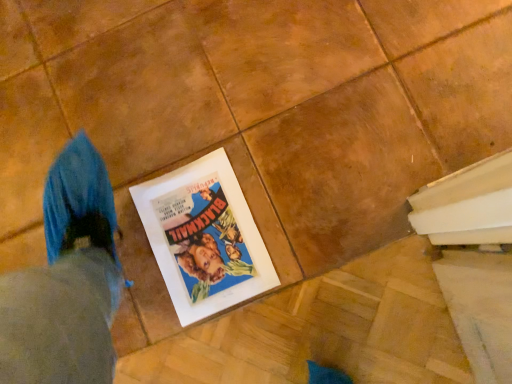
This screenshot has height=384, width=512. Find the location of `vacant area on top of matte paper comic book at center (from a real-world perspective)`. vacant area on top of matte paper comic book at center (from a real-world perspective) is located at coordinates (202, 226).